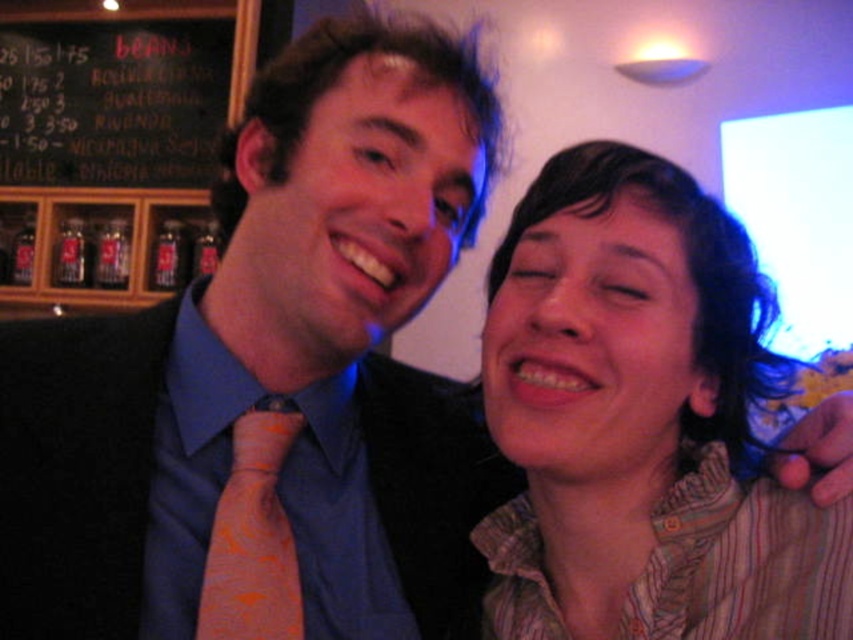
Is striped cotton shirt at right below orange patterned tie at center?

Incorrect, striped cotton shirt at right is not positioned below orange patterned tie at center.

The height and width of the screenshot is (640, 853). What do you see at coordinates (636, 417) in the screenshot?
I see `striped cotton shirt at right` at bounding box center [636, 417].

You are a GUI agent. You are given a task and a screenshot of the screen. Output one action in this format:
    pyautogui.click(x=<x>, y=<y>)
    Task: Click on the striped cotton shirt at right
    
    Given the screenshot: What is the action you would take?
    pyautogui.click(x=636, y=417)

Does point (534, 353) come farther from viewer compared to point (178, 179)?

No, it is not.

The width and height of the screenshot is (853, 640). Describe the element at coordinates (636, 417) in the screenshot. I see `striped cotton shirt at right` at that location.

Is point (706, 474) behind point (47, 8)?

No, it is not.

The height and width of the screenshot is (640, 853). Find the location of `striped cotton shirt at right`. striped cotton shirt at right is located at coordinates (636, 417).

Does black chalkboard at upper left appear on the left side of orange silk dress shirt at left?

Yes, black chalkboard at upper left is to the left of orange silk dress shirt at left.

Does point (15, 52) come behind point (164, 531)?

Yes, point (15, 52) is farther from viewer.

The height and width of the screenshot is (640, 853). In order to click on black chalkboard at upper left in this screenshot , I will do `click(119, 90)`.